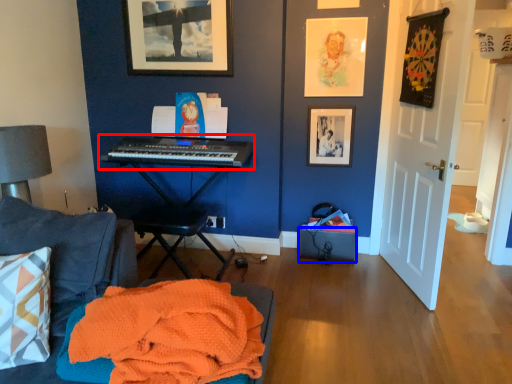
Question: Which of the following is the closest to the observer, musical keyboard (highlighted by a red box) or box (highlighted by a blue box)?

Choices:
 (A) musical keyboard
 (B) box

Answer: (A)